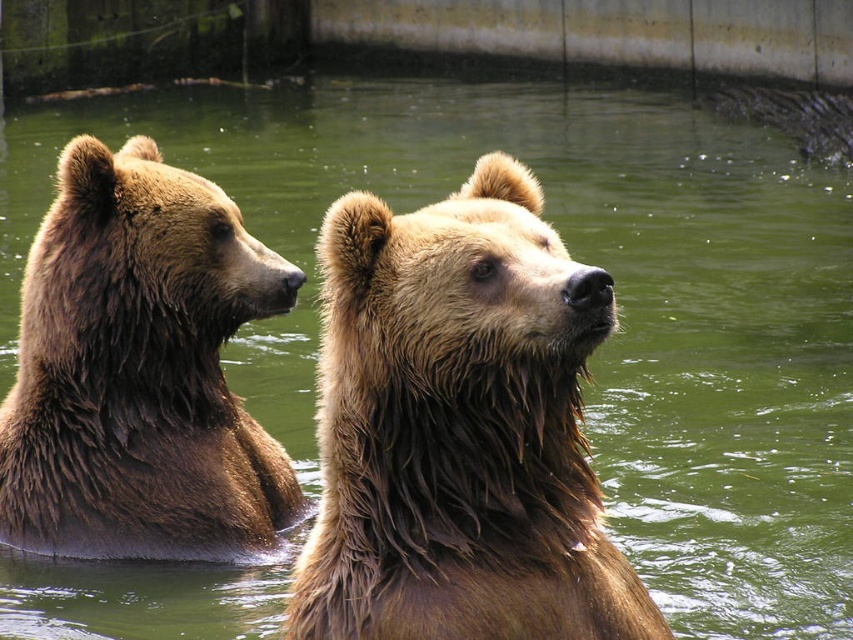
You are observing two bears in a zoo enclosure. You see a wet fur bear at center and a shaggy brown bear at center. Which bear is positioned to the right?

The wet fur bear at center is positioned to the right of the shaggy brown bear at center.

You are a zookeeper observing two bears in the enclosure. You notice the wet fur bear at center and the shaggy brown bear at center. Which bear takes up more space in the image?

The shaggy brown bear at center takes up more space in the image than the wet fur bear at center, as the wet fur bear at center occupies less space according to the description.